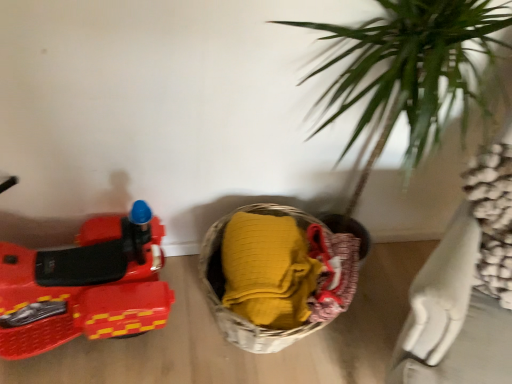
I want to click on free area in between shiny plastic toy car at left and woven fabric basket at lower center, so click(148, 337).